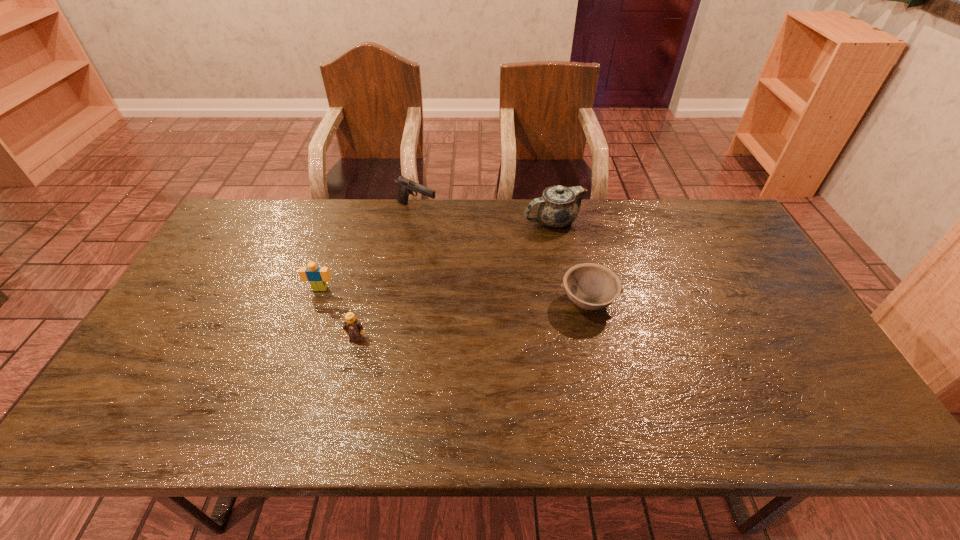
The height and width of the screenshot is (540, 960). In order to click on free point located at the muzzle of the gun in this screenshot , I will do [487, 209].

This screenshot has width=960, height=540. I want to click on vacant space located 0.130m on the face of the leftmost object, so click(306, 327).

Find the location of `vacant space located in front of the right Lego`. vacant space located in front of the right Lego is located at coordinates (347, 379).

The height and width of the screenshot is (540, 960). Find the location of `vacant space located 0.340m on the back of the bowl`. vacant space located 0.340m on the back of the bowl is located at coordinates (567, 212).

You are a GUI agent. You are given a task and a screenshot of the screen. Output one action in this format:
    pyautogui.click(x=<x>, y=<y>)
    Task: Click on the chinaware located in the far edge section of the desktop
    
    Given the screenshot: What is the action you would take?
    pyautogui.click(x=558, y=207)

Where is `gun at the far edge`? gun at the far edge is located at coordinates (406, 186).

In the image, there is a desktop. In order to click on free region at the far edge in this screenshot , I will do `click(333, 221)`.

Image resolution: width=960 pixels, height=540 pixels. In the image, there is a desktop. Find the location of `vacant space at the near edge`. vacant space at the near edge is located at coordinates coord(438,404).

Identify the location of blank space at the left edge of the desktop. The width and height of the screenshot is (960, 540). (204, 297).

I want to click on vacant space at the right edge of the desktop, so click(746, 298).